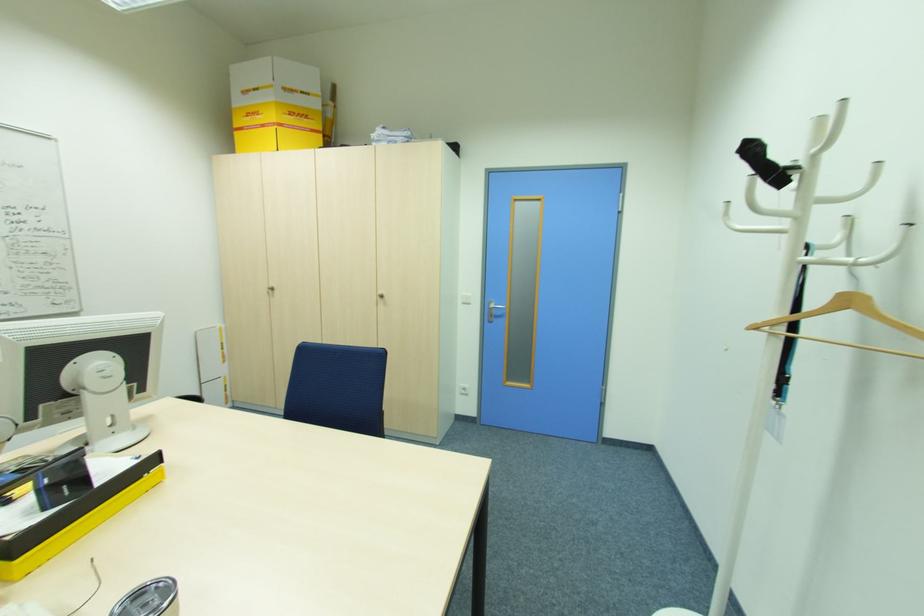
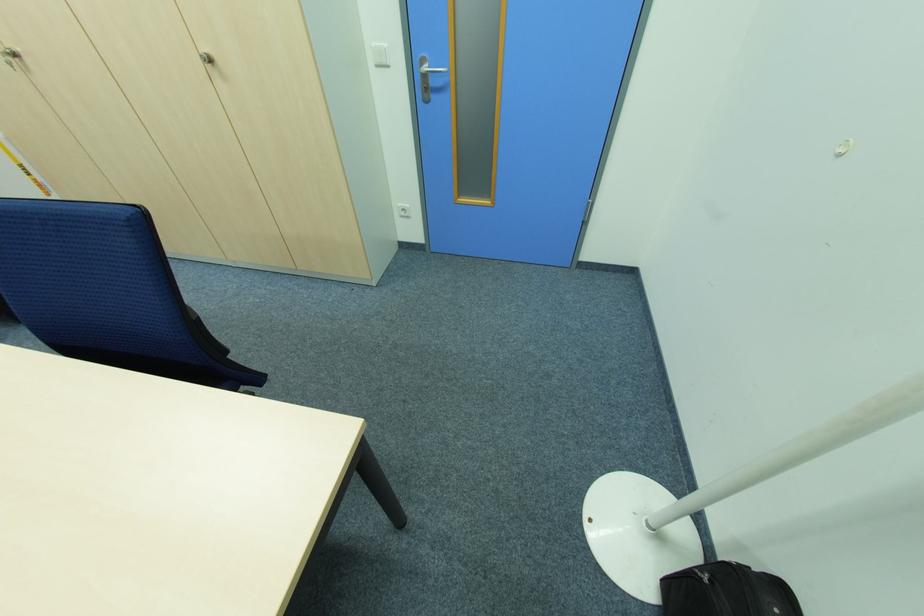
The point at (492, 302) is marked in the first image. Where is the corresponding point in the second image?

(424, 63)